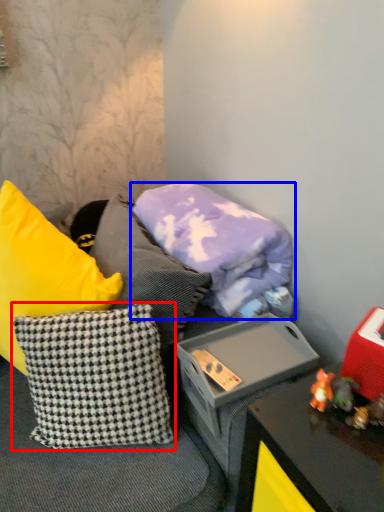
Question: Which object appears closest to the camera in this image, pillow (highlighted by a red box) or pillow (highlighted by a blue box)?

Choices:
 (A) pillow
 (B) pillow

Answer: (A)